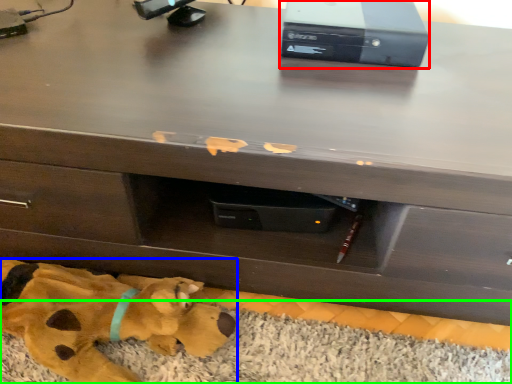
Question: Which object is positioned farthest from computer (highlighted by a red box)? Select from toy (highlighted by a blue box) and mat (highlighted by a green box).

Choices:
 (A) toy
 (B) mat

Answer: (A)